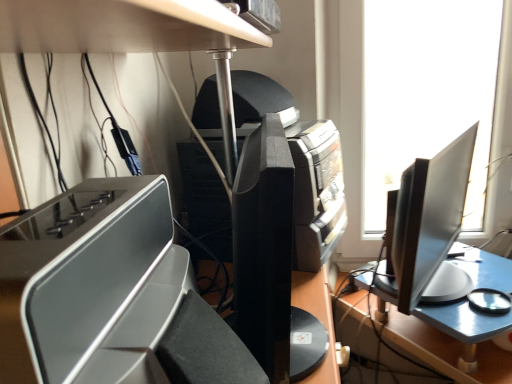
Measure the distance between point (220, 226) and camera.

Point (220, 226) is 1.01 meters from camera.

Image resolution: width=512 pixels, height=384 pixels. What do you see at coordinates (316, 192) in the screenshot?
I see `black plastic printer at center` at bounding box center [316, 192].

Locate an element on the screen. black plastic printer at center is located at coordinates (316, 192).

Locate an element on the screen. The height and width of the screenshot is (384, 512). white matte plastic tray at center is located at coordinates (317, 317).

Describe the element at coordinates (317, 317) in the screenshot. I see `white matte plastic tray at center` at that location.

Where is `black plastic printer at center`? This screenshot has width=512, height=384. black plastic printer at center is located at coordinates (316, 192).

Between white matte plastic tray at center and black plastic printer at center, which one appears on the right side from the viewer's perspective?

black plastic printer at center.

Is the depth of white matte plastic tray at center less than that of black plastic printer at center?

Yes, the depth of white matte plastic tray at center is less than that of black plastic printer at center.

Is point (307, 292) closer to camera compared to point (191, 219)?

Yes, it is.

From the image's perspective, is white matte plastic tray at center on black plastic printer at center?

No, from the image's perspective, white matte plastic tray at center is not above black plastic printer at center.

From a real-world perspective, between white matte plastic tray at center and black plastic printer at center, who is vertically higher?

black plastic printer at center.

Considering the relative sizes of white matte plastic tray at center and black plastic printer at center in the image provided, is white matte plastic tray at center wider than black plastic printer at center?

No, white matte plastic tray at center is not wider than black plastic printer at center.

Is white matte plastic tray at center shorter than black plastic printer at center?

Indeed, white matte plastic tray at center has a lesser height compared to black plastic printer at center.

From the picture: Does white matte plastic tray at center have a larger size compared to black plastic printer at center?

Actually, white matte plastic tray at center might be smaller than black plastic printer at center.

Is white matte plastic tray at center positioned beyond the bounds of black plastic printer at center?

Yes, white matte plastic tray at center is located beyond the bounds of black plastic printer at center.

Are white matte plastic tray at center and black plastic printer at center located far from each other?

No, there isn't a large distance between white matte plastic tray at center and black plastic printer at center.

Could you tell me if white matte plastic tray at center is facing black plastic printer at center?

No, white matte plastic tray at center is not aimed at black plastic printer at center.

Where is `printer to the right of white matte plastic tray at center`? The width and height of the screenshot is (512, 384). printer to the right of white matte plastic tray at center is located at coordinates (316, 192).

Is black plastic printer at center at the left side of white matte plastic tray at center?

No.

Which object is further away from the camera taking this photo, black plastic printer at center or white matte plastic tray at center?

black plastic printer at center is further from the camera.

Is point (209, 172) behind point (331, 311)?

No, (209, 172) is in front of (331, 311).

From the image's perspective, is black plastic printer at center beneath white matte plastic tray at center?

Actually, black plastic printer at center appears above white matte plastic tray at center in the image.

From a real-world perspective, is black plastic printer at center physically located above or below white matte plastic tray at center?

black plastic printer at center is situated higher than white matte plastic tray at center in the real world.

Between black plastic printer at center and white matte plastic tray at center, which one has smaller width?

white matte plastic tray at center.

Between black plastic printer at center and white matte plastic tray at center, which one has more height?

black plastic printer at center.

Who is bigger, black plastic printer at center or white matte plastic tray at center?

With larger size is black plastic printer at center.

Is black plastic printer at center not inside white matte plastic tray at center?

Yes.

Does black plastic printer at center touch white matte plastic tray at center?

No, black plastic printer at center is not next to white matte plastic tray at center.

Could you tell me if black plastic printer at center is turned towards white matte plastic tray at center?

No, black plastic printer at center is not aimed at white matte plastic tray at center.

I want to click on printer above the white matte plastic tray at center (from the image's perspective), so click(x=316, y=192).

You are a GUI agent. You are given a task and a screenshot of the screen. Output one action in this format:
    pyautogui.click(x=<x>, y=<y>)
    Task: Click on the desk that appears below the black plastic printer at center (from the image's perspective)
    This screenshot has width=512, height=384.
    Given the screenshot: What is the action you would take?
    pyautogui.click(x=317, y=317)

Locate an element on the screen. desk in front of the black plastic printer at center is located at coordinates (317, 317).